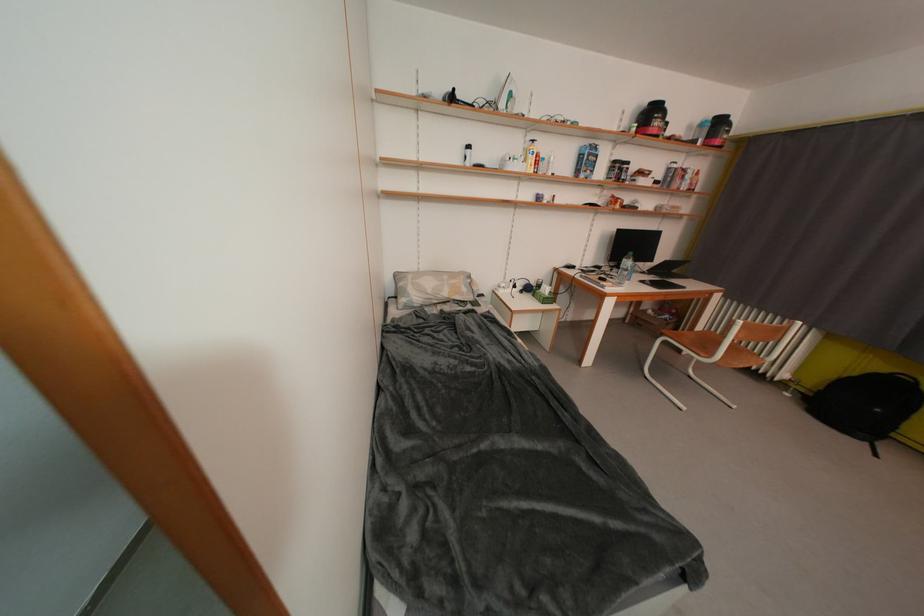
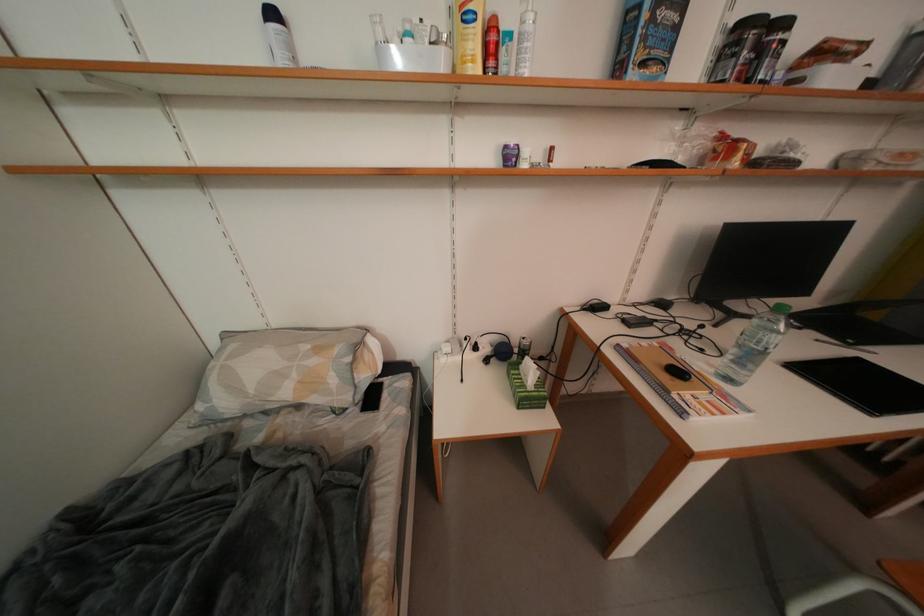
In a continuous first-person perspective shot, in which direction is the camera moving?

The movement direction of the cameraman is right, forward.